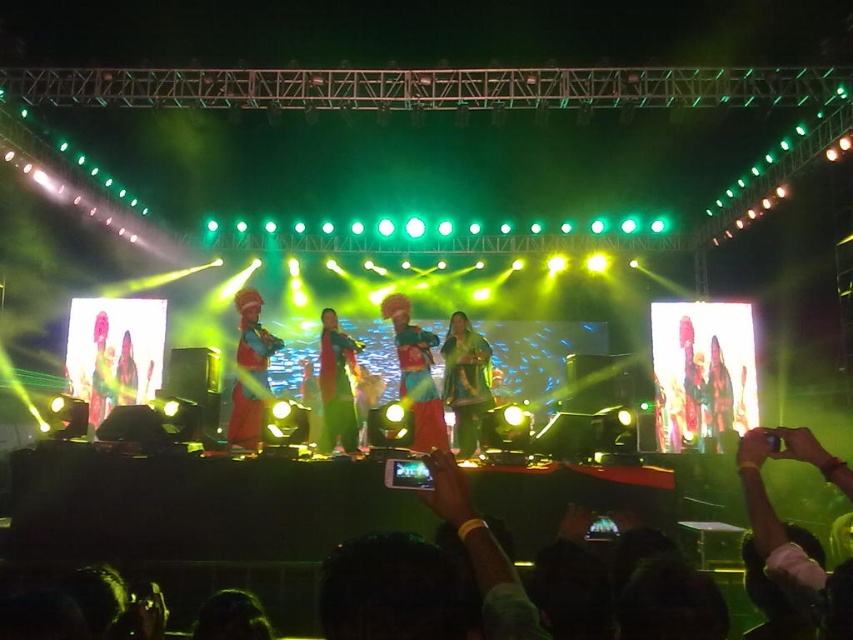
You are a photographer at the concert and want to capture a photo of both the green fabric dress at center and the multicolored fabric dress at center. Which dress should you focus on first if you want to frame them from left to right?

The multicolored fabric dress at center should be focused on first since it is positioned to the left of the green fabric dress at center, allowing you to frame them from left to right starting with the multicolored one.

You are a photographer at the concert and want to capture both the green fabric dress at center and the multicolored fabric dress at center in a single frame. Which dress should you focus on first to ensure both are in the shot?

The green fabric dress at center is shorter than the multicolored fabric dress at center. Focus on the multicolored fabric dress at center first to ensure both are in the frame.

You are a photographer capturing the live performance. You notice a point at coordinates (193, 506) in the image. Based on the scene description, what object or feature is located at this point?

The point at coordinates (193, 506) corresponds to dark skin hands at lower center.